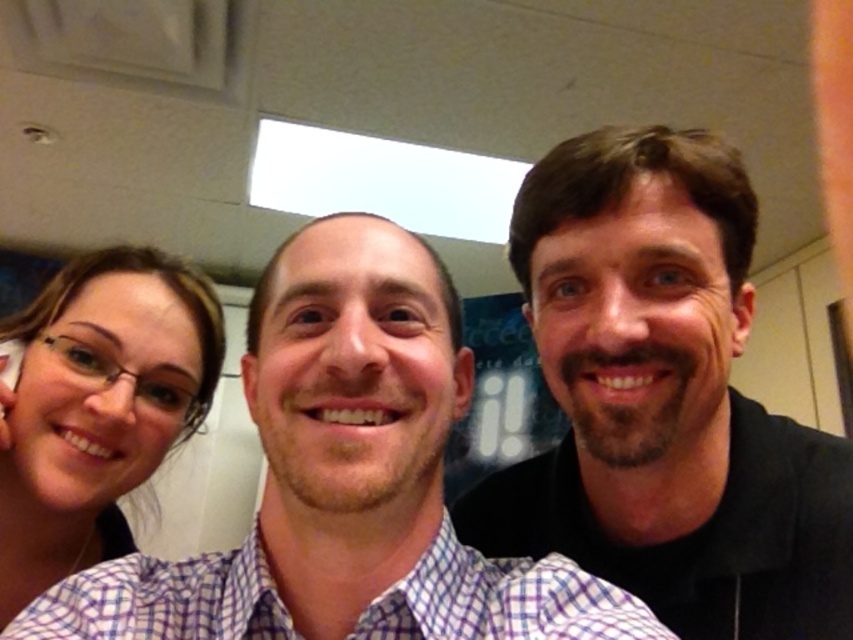
You are trying to decide which of the two shirts in the image is wider. You see the smooth black shirt at right and the matte purple shirt at left. Based on their positions and sizes, which one is wider?

The smooth black shirt at right is wider than the matte purple shirt at left.

You are trying to decide which shirt to wear for a casual event. You have the smooth black shirt at right and the matte purple shirt at left. According to the image, which shirt is bigger?

The smooth black shirt at right is larger in size than the matte purple shirt at left, so the smooth black shirt at right is bigger.